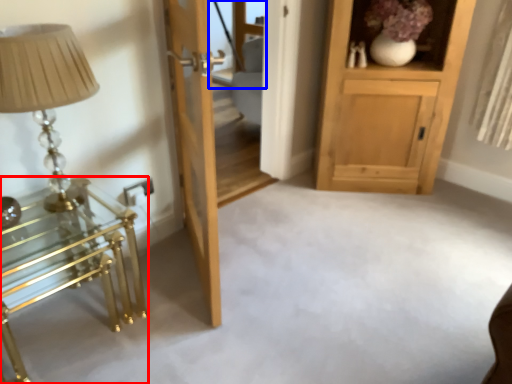
Question: Which object is further to the camera taking this photo, table (highlighted by a red box) or glass door (highlighted by a blue box)?

Choices:
 (A) table
 (B) glass door

Answer: (B)